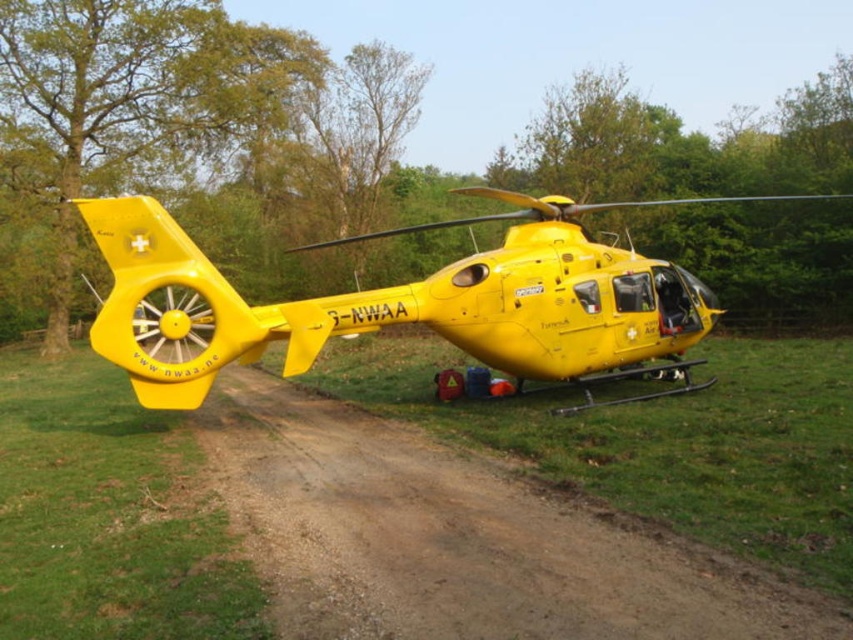
You are a pilot trying to take off with the yellow matte helicopter at center. The brown dirt track at center is the only available runway. Can the helicopter safely take off from the runway given its width?

The brown dirt track at center is narrower than the yellow matte helicopter at center, so the helicopter cannot safely take off from the runway as it is too narrow.

You are standing in front of the helicopter and want to locate two points marked on the helicopter. The first point is at coordinates point (381, 584) and the second is at point (172, 248). Which point is nearer to your current position?

Point (381, 584) is closer to the camera than point (172, 248), so the first point is nearer to your current position.